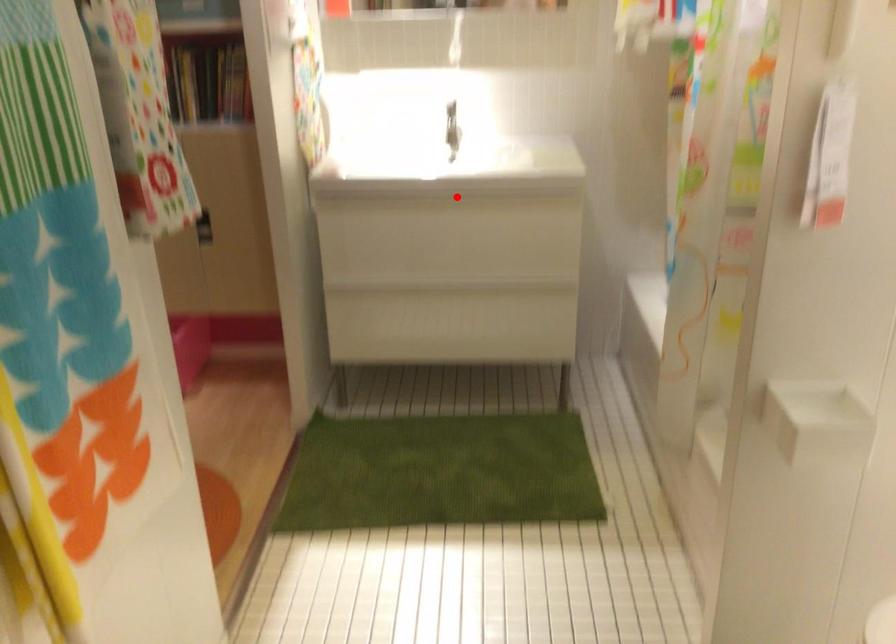
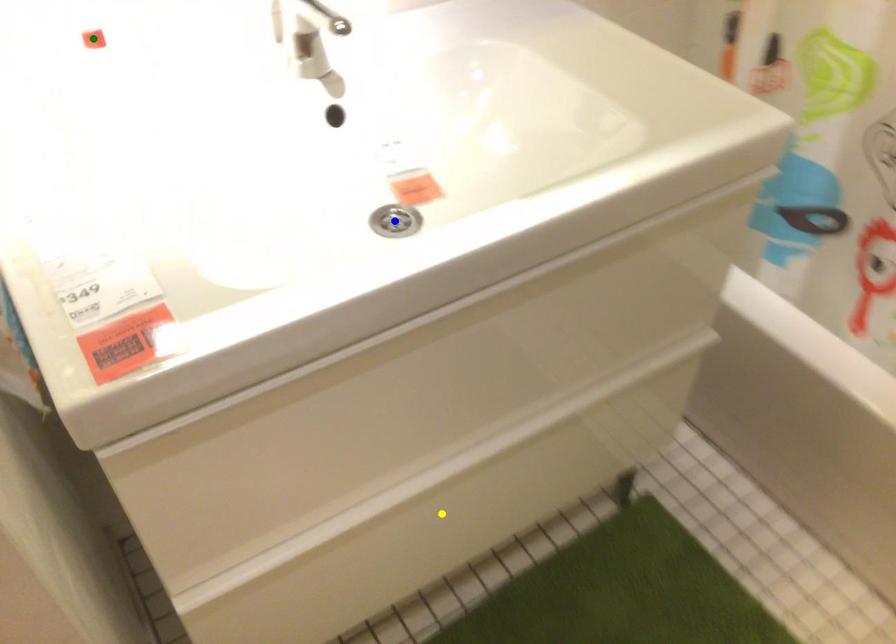
Question: I am providing you with two images of the same scene from different viewpoints. A red point is marked on the first image. You are given multiple points on the second image. Which point in image 2 represents the same 3d spot as the red point in image 1?

Choices:
 (A) blue point
 (B) green point
 (C) yellow point

Answer: (A)